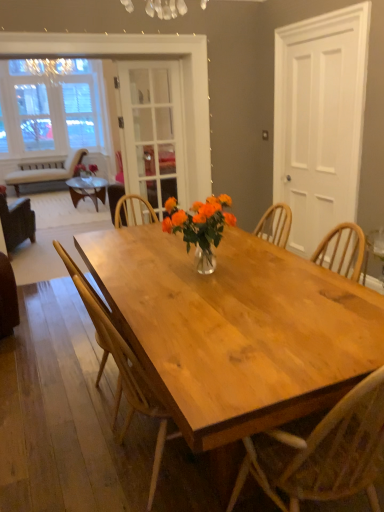
This screenshot has height=512, width=384. Find the location of `natural wood chair at center, the 2th chair from the back`. natural wood chair at center, the 2th chair from the back is located at coordinates (121, 368).

Identify the location of clear glass screen door at center, the 1th screen door viewed from the left. (153, 132).

The image size is (384, 512). Describe the element at coordinates (153, 132) in the screenshot. I see `clear glass screen door at center, the 1th screen door viewed from the left` at that location.

What is the approximate height of white matte door at right, placed as the first screen door when sorted from right to left?

6.09 feet.

Identify the location of natural wood chair at center, which ranks as the 2th chair in left-to-right order. This screenshot has width=384, height=512. (121, 368).

From a real-world perspective, which object stands above the other?

clear glass screen door at center, acting as the 2th screen door starting from the right, from a real-world perspective.

Consider the image. Considering the positions of objects clear glass screen door at center, the 1th screen door viewed from the left, and translucent glass vase at center in the image provided, who is in front, clear glass screen door at center, the 1th screen door viewed from the left, or translucent glass vase at center?

Positioned in front is translucent glass vase at center.

Would you say clear glass screen door at center, the 1th screen door viewed from the left, is inside or outside translucent glass vase at center?

The correct answer is: outside.

Considering the positions of objects clear glass screen door at center, the 1th screen door viewed from the left, and translucent glass vase at center in the image provided, who is more to the right, clear glass screen door at center, the 1th screen door viewed from the left, or translucent glass vase at center?

translucent glass vase at center.

Is natural wood chair at center, which ranks as the 2th chair in left-to-right order, smaller than clear glass screen door at center, the 1th screen door viewed from the left?

No.

Which point is more forward, (123, 366) or (153, 118)?

Point (123, 366)

Is natural wood chair at center, the second chair from the right, inside or outside of clear glass screen door at center, the 1th screen door viewed from the left?

natural wood chair at center, the second chair from the right, is located beyond the bounds of clear glass screen door at center, the 1th screen door viewed from the left.

Considering the sizes of translucent glass vase at center and clear glass screen door at center, the 1th screen door viewed from the left, in the image, is translucent glass vase at center wider or thinner than clear glass screen door at center, the 1th screen door viewed from the left,?

Clearly, translucent glass vase at center has more width compared to clear glass screen door at center, the 1th screen door viewed from the left.

I want to click on floral arrangement on the right of clear glass screen door at center, the 1th screen door viewed from the left, so click(200, 227).

Is translucent glass vase at center next to clear glass screen door at center, the 1th screen door viewed from the left?

No, translucent glass vase at center is not in contact with clear glass screen door at center, the 1th screen door viewed from the left.

Is translucent glass vase at center positioned with its back to clear glass screen door at center, acting as the 2th screen door starting from the right?

No, clear glass screen door at center, acting as the 2th screen door starting from the right, is not at the back of translucent glass vase at center.

Locate an element on the screen. The height and width of the screenshot is (512, 384). screen door that appears on the right of wooden chair at center, which is counted as the 1th chair, starting from the front is located at coordinates (320, 120).

Is point (380, 434) in front of point (296, 161)?

Yes.

How different are the orientations of wooden chair at center, the third chair positioned from the back, and white matte door at right, placed as the first screen door when sorted from right to left, in degrees?

91.2 degrees separate the facing orientations of wooden chair at center, the third chair positioned from the back, and white matte door at right, placed as the first screen door when sorted from right to left.

From the image's perspective, would you say wooden chair at center, the third chair positioned from the back, is shown under white matte door at right, acting as the second screen door starting from the left?

Yes.

From the picture: From the image's perspective, relative to translucent glass vase at center, is white matte door at right, placed as the first screen door when sorted from right to left, above or below?

Clearly, from the image's perspective, white matte door at right, placed as the first screen door when sorted from right to left, is above translucent glass vase at center.

Based on the photo, does white matte door at right, acting as the second screen door starting from the left, have a greater height compared to translucent glass vase at center?

Indeed, white matte door at right, acting as the second screen door starting from the left, has a greater height compared to translucent glass vase at center.

Is white matte door at right, acting as the second screen door starting from the left, with translucent glass vase at center?

white matte door at right, acting as the second screen door starting from the left, and translucent glass vase at center are not in contact.

Is translucent glass vase at center surrounded by white matte door at right, placed as the first screen door when sorted from right to left?

No, translucent glass vase at center is not surrounded by white matte door at right, placed as the first screen door when sorted from right to left.

Consider the image. Does white matte door at right, acting as the second screen door starting from the left, have a larger size compared to velvet green sofa at left?

Incorrect, white matte door at right, acting as the second screen door starting from the left, is not larger than velvet green sofa at left.

Is white matte door at right, placed as the first screen door when sorted from right to left, positioned with its back to velvet green sofa at left?

white matte door at right, placed as the first screen door when sorted from right to left, does not have its back to velvet green sofa at left.

Is white matte door at right, acting as the second screen door starting from the left, next to velvet green sofa at left and touching it?

No, white matte door at right, acting as the second screen door starting from the left, is not next to velvet green sofa at left.

Can you confirm if white matte door at right, acting as the second screen door starting from the left, is wider than velvet green sofa at left?

In fact, white matte door at right, acting as the second screen door starting from the left, might be narrower than velvet green sofa at left.

Measure the distance from brown leather chair at left, which ranks as the third chair in front-to-back order, to velvet green sofa at left.

brown leather chair at left, which ranks as the third chair in front-to-back order, and velvet green sofa at left are 6.23 feet apart.

Is brown leather chair at left, which appears as the first chair when viewed from the left, smaller than velvet green sofa at left?

Correct, brown leather chair at left, which appears as the first chair when viewed from the left, occupies less space than velvet green sofa at left.

Who is taller, brown leather chair at left, the 3th chair when ordered from right to left, or velvet green sofa at left?

brown leather chair at left, the 3th chair when ordered from right to left, is taller.

How many degrees apart are the facing directions of brown leather chair at left, which ranks as the third chair in front-to-back order, and velvet green sofa at left?

The angle between the facing direction of brown leather chair at left, which ranks as the third chair in front-to-back order, and the facing direction of velvet green sofa at left is 152 degrees.

Identify the location of floral arrangement to the right of clear glass screen door at center, the 1th screen door viewed from the left. The image size is (384, 512). (200, 227).

From the image's perspective, starting from the natural wood chair at center, placed as the second chair when sorted from front to back, which screen door is the 2nd one above? Please provide its 2D coordinates.

[(153, 132)]

From the image, which object appears to be farther from brown leather chair at left, the 3th chair when ordered from right to left, translucent glass vase at center or natural wood chair at center, the 2th chair from the back?

natural wood chair at center, the 2th chair from the back.

Based on their spatial positions, is natural wood chair at center, which ranks as the 2th chair in left-to-right order, or clear glass screen door at center, acting as the 2th screen door starting from the right, further from brown leather chair at left, which ranks as the third chair in front-to-back order?

Among the two, natural wood chair at center, which ranks as the 2th chair in left-to-right order, is located further to brown leather chair at left, which ranks as the third chair in front-to-back order.

Looking at the image, which one is located closer to velvet green sofa at left, white matte door at right, acting as the second screen door starting from the left, or translucent glass vase at center?

Based on the image, white matte door at right, acting as the second screen door starting from the left, appears to be nearer to velvet green sofa at left.

Looking at the image, which one is located closer to wooden chair at center, the third chair positioned from the back, velvet green sofa at left or clear glass screen door at center, the 1th screen door viewed from the left?

clear glass screen door at center, the 1th screen door viewed from the left, lies closer to wooden chair at center, the third chair positioned from the back, than the other object.

When comparing their distances from translucent glass vase at center, does clear glass screen door at center, acting as the 2th screen door starting from the right, or white matte door at right, acting as the second screen door starting from the left, seem closer?

white matte door at right, acting as the second screen door starting from the left, is positioned closer to the anchor translucent glass vase at center.

Looking at the image, which one is located further to translucent glass vase at center, brown leather chair at left, which is the 1th chair in back-to-front order, or wooden chair at center, which is counted as the 1th chair, starting from the front?

brown leather chair at left, which is the 1th chair in back-to-front order.

Looking at the image, which one is located further to brown leather chair at left, the 3th chair when ordered from right to left, wooden chair at center, which appears as the 1th chair when viewed from the right, or translucent glass vase at center?

wooden chair at center, which appears as the 1th chair when viewed from the right, is positioned further to the anchor brown leather chair at left, the 3th chair when ordered from right to left.

When comparing their distances from brown leather chair at left, which ranks as the third chair in front-to-back order, does white matte door at right, placed as the first screen door when sorted from right to left, or velvet green sofa at left seem further?

white matte door at right, placed as the first screen door when sorted from right to left, is further to brown leather chair at left, which ranks as the third chair in front-to-back order.

Identify the location of chair positioned between white matte door at right, acting as the second screen door starting from the left, and velvet green sofa at left from near to far. (16, 221).

You are a GUI agent. You are given a task and a screenshot of the screen. Output one action in this format:
    pyautogui.click(x=<x>, y=<y>)
    Task: Click on the screen door between natural wood chair at center, the second chair from the right, and clear glass screen door at center, acting as the 2th screen door starting from the right, in the front-back direction
    
    Given the screenshot: What is the action you would take?
    pyautogui.click(x=320, y=120)

Image resolution: width=384 pixels, height=512 pixels. In order to click on screen door positioned between wooden chair at center, which appears as the 1th chair when viewed from the right, and clear glass screen door at center, the 1th screen door viewed from the left, from near to far in this screenshot , I will do `click(320, 120)`.

Where is `screen door between white matte door at right, acting as the second screen door starting from the left, and velvet green sofa at left, along the z-axis`? The width and height of the screenshot is (384, 512). screen door between white matte door at right, acting as the second screen door starting from the left, and velvet green sofa at left, along the z-axis is located at coordinates (153, 132).